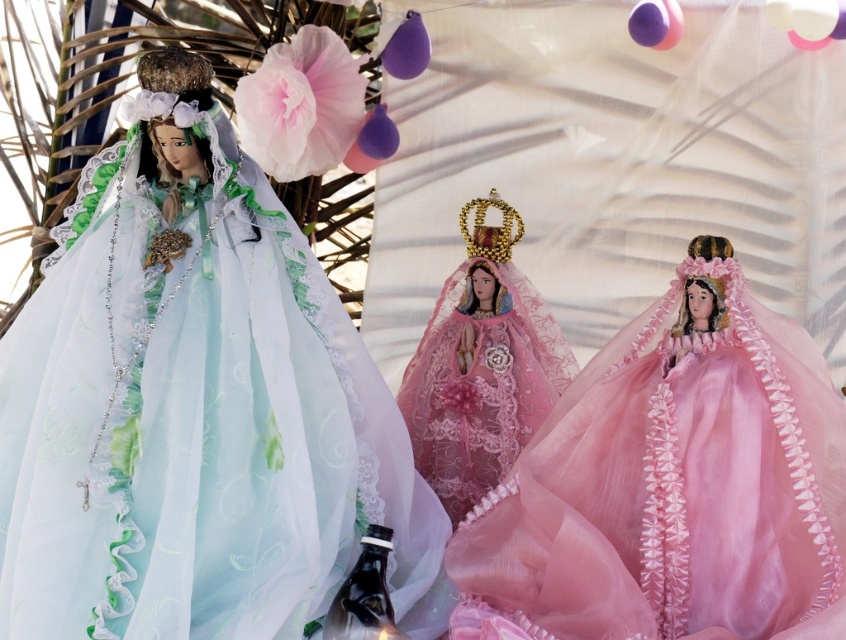
You are a guest at a party and see the pink tulle dress at center and the pink lace dress at center. Which one is closer to the floor?

The pink tulle dress at center is below the pink lace dress at center, so it is closer to the floor.

You are a photographer setting up a shoot in front of a white backdrop. You have two figurines wearing the matte green tulle dress at left and the pink tulle dress at center. You want to ensure that both figurines are fully visible in the photo. Given their current positions, which figurine should you move forward to avoid being blocked by the other?

The pink tulle dress at center is currently behind the matte green tulle dress at left. To ensure both are fully visible, you should move the pink tulle dress at center forward so it is no longer blocked by the matte green tulle dress at left.